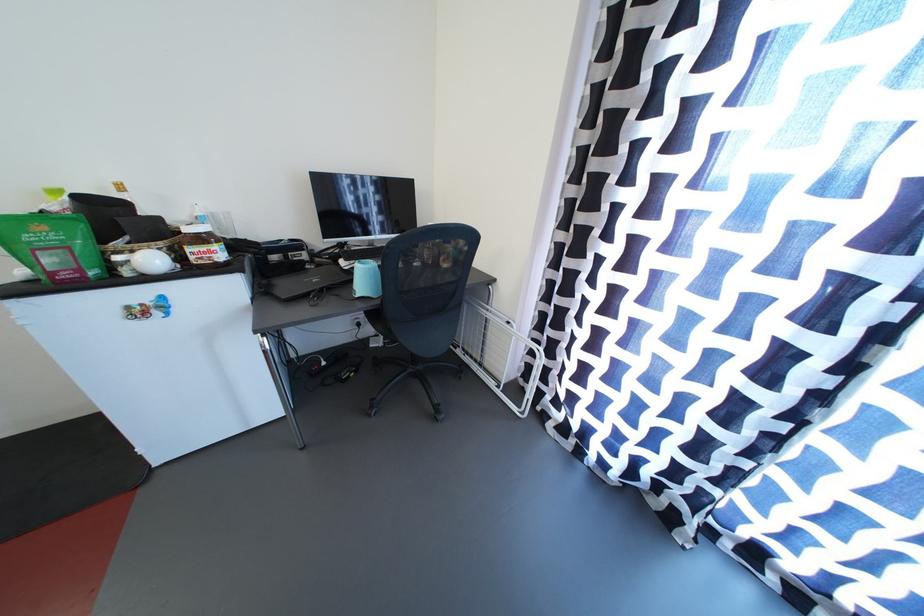
Image resolution: width=924 pixels, height=616 pixels. Find the location of `large green bag`. large green bag is located at coordinates (53, 246).